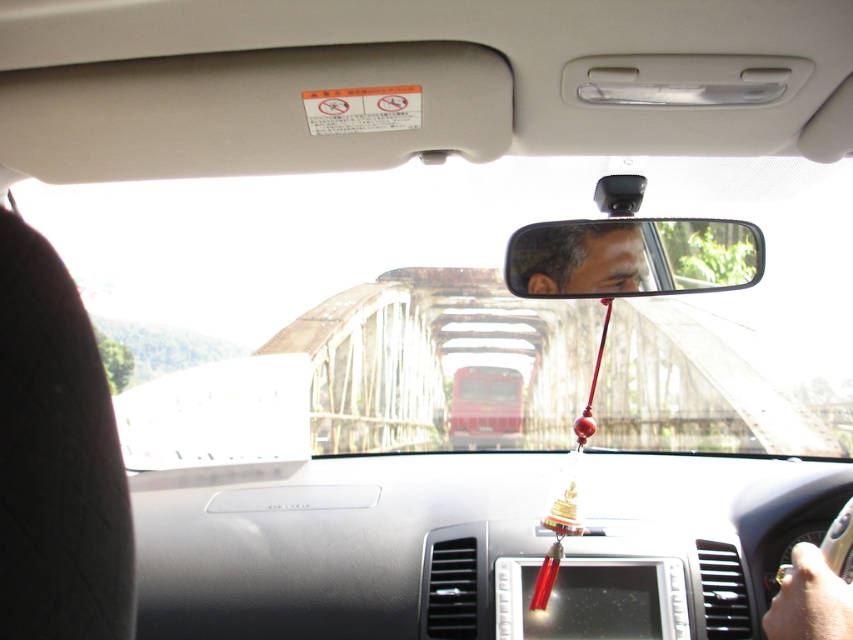
Between black leather seat at left and matte black mirror at center, which one is positioned higher?

matte black mirror at center is above.

Between point (74, 337) and point (657, 221), which one is positioned behind?

The point (657, 221) is more distant.

Where is `black leather seat at left`? Image resolution: width=853 pixels, height=640 pixels. black leather seat at left is located at coordinates (56, 458).

Is point (218, 225) behind point (33, 380)?

That is True.

Looking at this image, can you confirm if transparent glass bridge at center is wider than black leather seat at left?

Yes, transparent glass bridge at center is wider than black leather seat at left.

Locate an element on the screen. transparent glass bridge at center is located at coordinates (351, 289).

Which is in front, point (421, 378) or point (679, 275)?

Point (679, 275)

Is point (300, 337) farther from camera compared to point (709, 250)?

Yes, point (300, 337) is behind point (709, 250).

At what (x,y) coordinates should I click in order to perform the action: click on transparent glass bridge at center. Please return your answer as a coordinate pair (x, y). Looking at the image, I should click on (351, 289).